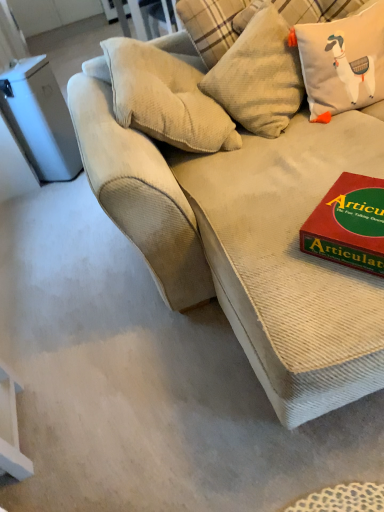
Question: From a real-world perspective, is beige corduroy couch at center above or below textured beige pillow at upper center, the 2th pillow when ordered from right to left?

Choices:
 (A) below
 (B) above

Answer: (A)

Question: Considering the positions of beige corduroy couch at center and textured beige pillow at upper center, the 2th pillow when ordered from right to left, in the image, is beige corduroy couch at center taller or shorter than textured beige pillow at upper center, the 2th pillow when ordered from right to left,?

Choices:
 (A) tall
 (B) short

Answer: (A)

Question: Estimate the real-world distances between objects in this image. Which object is closer to the red cardboard game at right?

Choices:
 (A) textured beige pillow at upper center, which is the first pillow from left to right
 (B) beige textured cushion at upper right, which is the 2th pillow from left to right
 (C) beige corduroy couch at center

Answer: (C)

Question: Based on their relative distances, which object is nearer to the textured beige pillow at upper center, which is the first pillow from left to right?

Choices:
 (A) beige corduroy couch at center
 (B) beige textured cushion at upper right, positioned as the first pillow in right-to-left order
 (C) red cardboard game at right

Answer: (B)